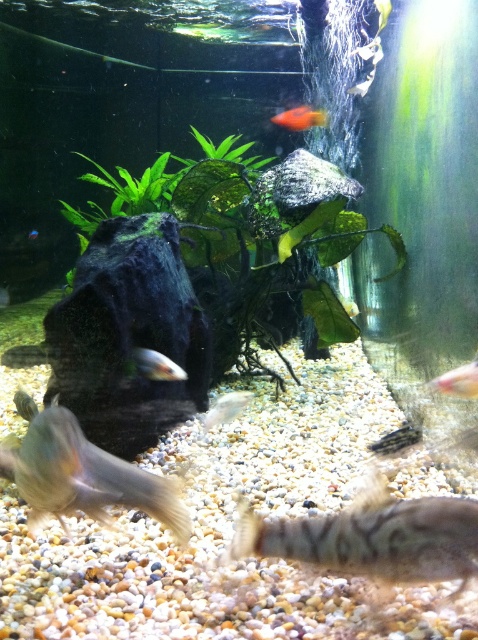
Does brown textured fish at bottom appear on the right side of matte silver fish at center?

→ Correct, you'll find brown textured fish at bottom to the right of matte silver fish at center.

Which is in front, point (449, 556) or point (175, 371)?

Point (449, 556)

Find the location of `brown textured fish at bottom`. brown textured fish at bottom is located at coordinates (371, 536).

Between matte silver fish at center and translucent plastic fish at center, which one appears on the right side from the viewer's perspective?

From the viewer's perspective, translucent plastic fish at center appears more on the right side.

Who is taller, matte silver fish at center or translucent plastic fish at center?

matte silver fish at center is taller.

Is point (182, 371) farther from camera compared to point (215, 406)?

No, it is in front of (215, 406).

Find the location of a particular element. This screenshot has width=478, height=640. matte silver fish at center is located at coordinates (156, 365).

Who is more distant from viewer, (30,456) or (220,416)?

The point (220,416) is behind.

Can you confirm if translucent yellowish fish at bottom left is thinner than translucent plastic fish at center?

No, translucent yellowish fish at bottom left is not thinner than translucent plastic fish at center.

Measure the distance between point [96,477] and camera.

Point [96,477] is 5.74 feet from camera.

This screenshot has height=640, width=478. What are the coordinates of `translucent yellowish fish at bottom left` in the screenshot? It's located at [x=87, y=476].